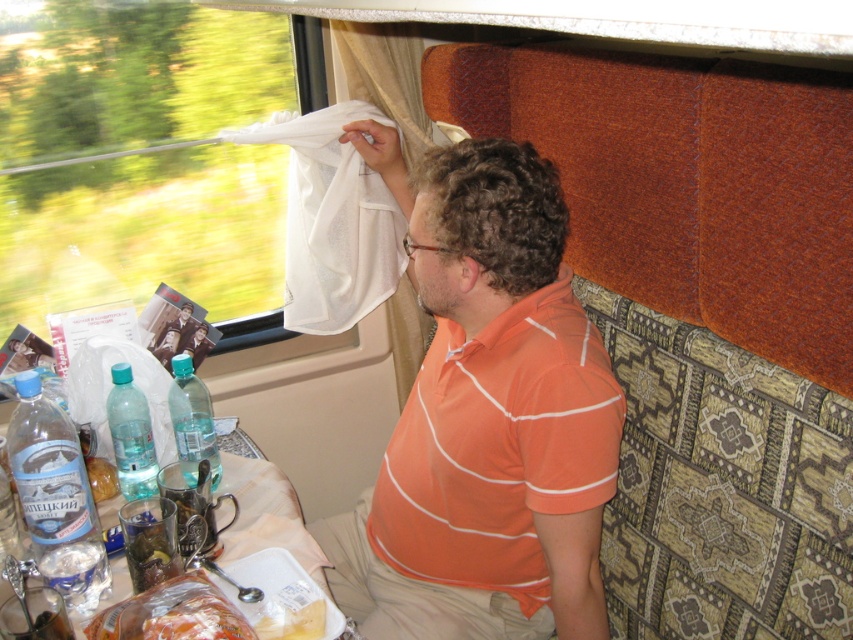
Question: Can you confirm if orange striped shirt at upper right is bigger than white fabric at left?

Choices:
 (A) yes
 (B) no

Answer: (B)

Question: Which point is farther to the camera?

Choices:
 (A) (192, 388)
 (B) (184, 625)
 (C) (13, 177)
 (D) (345, 324)

Answer: (D)

Question: Observing the image, what is the correct spatial positioning of white sheer cloth at upper left in reference to transparent plastic bottle at table left?

Choices:
 (A) above
 (B) below

Answer: (A)

Question: Which of the following is the farthest from the observer?

Choices:
 (A) (164, 620)
 (B) (592, 404)
 (C) (161, 202)

Answer: (C)

Question: Does translucent plastic bag at lower left appear under transparent plastic bottle at table left?

Choices:
 (A) yes
 (B) no

Answer: (A)

Question: Among these points, which one is farthest from the camera?

Choices:
 (A) (143, 442)
 (B) (233, 624)
 (C) (386, 116)
 (D) (48, 504)

Answer: (C)